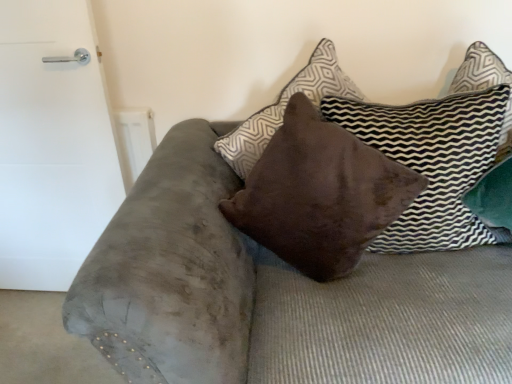
Describe the element at coordinates (432, 162) in the screenshot. Image resolution: width=512 pixels, height=384 pixels. I see `brown velvet pillow at center, the 1th pillow in the right-to-left sequence` at that location.

Find the location of a particular element. brown suede pillow at center, positioned as the second pillow in right-to-left order is located at coordinates (320, 194).

Can you confirm if brown velvet pillow at center, which is the 2th pillow from left to right, is thinner than brown suede pillow at center, positioned as the second pillow in right-to-left order?

Yes, brown velvet pillow at center, which is the 2th pillow from left to right, is thinner than brown suede pillow at center, positioned as the second pillow in right-to-left order.

Is brown velvet pillow at center, which is the 2th pillow from left to right, far away from brown suede pillow at center, positioned as the 1th pillow in left-to-right order?

brown velvet pillow at center, which is the 2th pillow from left to right, is near brown suede pillow at center, positioned as the 1th pillow in left-to-right order, not far away.

Does point (441, 249) appear closer or farther from the camera than point (225, 206)?

Point (441, 249) is farther from the camera than point (225, 206).

From the picture: Considering the sizes of objects brown velvet pillow at center, which is the 2th pillow from left to right, and white matte door at left in the image provided, who is taller, brown velvet pillow at center, which is the 2th pillow from left to right, or white matte door at left?

With more height is white matte door at left.

In the image, is brown velvet pillow at center, the 1th pillow in the right-to-left sequence, positioned in front of or behind white matte door at left?

brown velvet pillow at center, the 1th pillow in the right-to-left sequence, is positioned closer to the viewer than white matte door at left.

Can white matte door at left be found inside brown velvet pillow at center, which is the 2th pillow from left to right?

No.

Which point is more forward, (467, 148) or (59, 9)?

The point (467, 148) is closer to the camera.

Identify the location of pillow located below the white matte door at left (from the image's perspective). The image size is (512, 384). (432, 162).

Is white matte door at left turned away from brown velvet pillow at center, which is the 2th pillow from left to right?

That's not correct — white matte door at left is not looking away from brown velvet pillow at center, which is the 2th pillow from left to right.

Can you confirm if brown suede pillow at center, positioned as the 1th pillow in left-to-right order, is thinner than brown velvet pillow at center, which is the 2th pillow from left to right?

In fact, brown suede pillow at center, positioned as the 1th pillow in left-to-right order, might be wider than brown velvet pillow at center, which is the 2th pillow from left to right.

Is point (393, 219) in front of point (393, 137)?

That is True.

Is brown suede pillow at center, positioned as the second pillow in right-to-left order, with brown velvet pillow at center, which is the 2th pillow from left to right?

No, brown suede pillow at center, positioned as the second pillow in right-to-left order, is not next to brown velvet pillow at center, which is the 2th pillow from left to right.

From the picture: Between white matte door at left and brown suede pillow at center, positioned as the second pillow in right-to-left order, which one has larger size?

brown suede pillow at center, positioned as the second pillow in right-to-left order, is bigger.

Is white matte door at left beside brown suede pillow at center, positioned as the 1th pillow in left-to-right order?

No, white matte door at left is not in contact with brown suede pillow at center, positioned as the 1th pillow in left-to-right order.

From a real-world perspective, who is located lower, white matte door at left or brown suede pillow at center, positioned as the second pillow in right-to-left order?

white matte door at left, from a real-world perspective.

From the image's perspective, is white matte door at left under brown suede pillow at center, positioned as the 1th pillow in left-to-right order?

Indeed, from the image's perspective, white matte door at left is shown beneath brown suede pillow at center, positioned as the 1th pillow in left-to-right order.

Considering the positions of points (330, 190) and (93, 55), is point (330, 190) farther from camera compared to point (93, 55)?

No.

Is brown suede pillow at center, positioned as the 1th pillow in left-to-right order, beside white matte door at left?

No.

In the image, is brown suede pillow at center, positioned as the 1th pillow in left-to-right order, positioned in front of or behind white matte door at left?

brown suede pillow at center, positioned as the 1th pillow in left-to-right order, is positioned closer to the viewer than white matte door at left.

In order to click on door on the left side of brown suede pillow at center, positioned as the 1th pillow in left-to-right order in this screenshot , I will do `click(52, 144)`.

At what (x,y) coordinates should I click in order to perform the action: click on pillow located on the left of brown velvet pillow at center, the 1th pillow in the right-to-left sequence. Please return your answer as a coordinate pair (x, y). Image resolution: width=512 pixels, height=384 pixels. Looking at the image, I should click on (320, 194).

The width and height of the screenshot is (512, 384). I want to click on door below the brown velvet pillow at center, which is the 2th pillow from left to right (from a real-world perspective), so click(x=52, y=144).

Which object lies nearer to the anchor point white matte door at left, brown velvet pillow at center, which is the 2th pillow from left to right, or brown suede pillow at center, positioned as the second pillow in right-to-left order?

brown suede pillow at center, positioned as the second pillow in right-to-left order.

When comparing their distances from white matte door at left, does brown suede pillow at center, positioned as the second pillow in right-to-left order, or brown velvet pillow at center, which is the 2th pillow from left to right, seem closer?

Among the two, brown suede pillow at center, positioned as the second pillow in right-to-left order, is located nearer to white matte door at left.

From the picture: Estimate the real-world distances between objects in this image. Which object is closer to brown velvet pillow at center, the 1th pillow in the right-to-left sequence, brown suede pillow at center, positioned as the 1th pillow in left-to-right order, or white matte door at left?

brown suede pillow at center, positioned as the 1th pillow in left-to-right order, is positioned closer to the anchor brown velvet pillow at center, the 1th pillow in the right-to-left sequence.

Considering their positions, is white matte door at left positioned further to brown velvet pillow at center, the 1th pillow in the right-to-left sequence, than brown suede pillow at center, positioned as the 1th pillow in left-to-right order?

Among the two, white matte door at left is located further to brown velvet pillow at center, the 1th pillow in the right-to-left sequence.

Looking at the image, which one is located further to brown suede pillow at center, positioned as the 1th pillow in left-to-right order, white matte door at left or brown velvet pillow at center, which is the 2th pillow from left to right?

Among the two, white matte door at left is located further to brown suede pillow at center, positioned as the 1th pillow in left-to-right order.

Which object lies nearer to the anchor point brown suede pillow at center, positioned as the 1th pillow in left-to-right order, brown velvet pillow at center, the 1th pillow in the right-to-left sequence, or white matte door at left?

brown velvet pillow at center, the 1th pillow in the right-to-left sequence, is closer to brown suede pillow at center, positioned as the 1th pillow in left-to-right order.

Where is `pillow situated between white matte door at left and brown velvet pillow at center, which is the 2th pillow from left to right, from left to right`? pillow situated between white matte door at left and brown velvet pillow at center, which is the 2th pillow from left to right, from left to right is located at coordinates (320, 194).